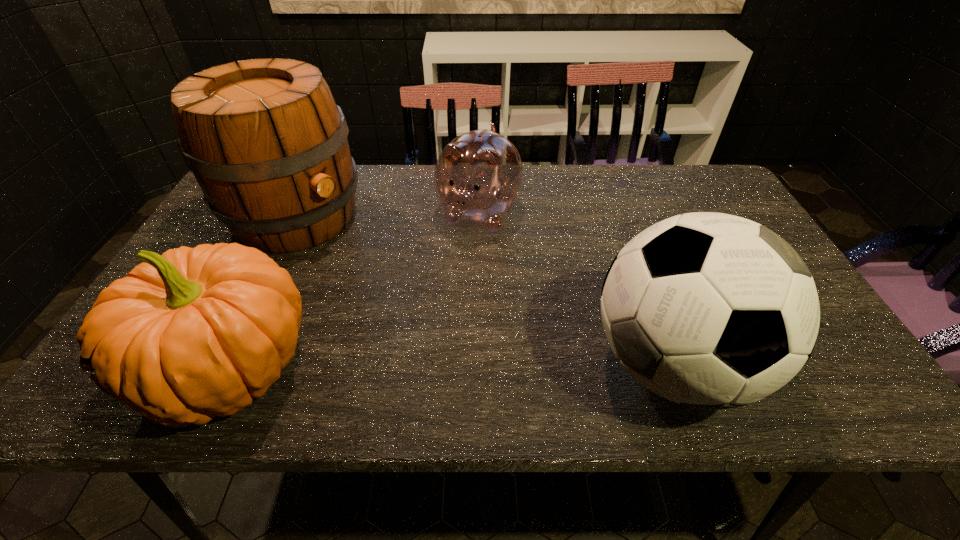
The width and height of the screenshot is (960, 540). I want to click on pumpkin, so coord(194,333).

This screenshot has width=960, height=540. I want to click on the rightmost object, so click(714, 311).

Where is `cider`? cider is located at coordinates pyautogui.click(x=265, y=140).

Locate an element on the screen. piggy bank is located at coordinates (478, 176).

At what (x,y) coordinates should I click in order to perform the action: click on the shortest object. Please return your answer as a coordinate pair (x, y). Looking at the image, I should click on (478, 176).

The image size is (960, 540). What are the coordinates of `free spot located 0.100m on the main logo of the soccer ball` in the screenshot? It's located at (804, 364).

I want to click on free space located 0.080m on the side of the cider where the spigot is located, so click(358, 258).

Image resolution: width=960 pixels, height=540 pixels. I want to click on blank space located 0.070m on the side of the cider where the spigot is located, so click(x=355, y=256).

This screenshot has width=960, height=540. I want to click on vacant space positioned 0.210m on the side of the cider where the spigot is located, so click(392, 281).

Locate an element on the screen. Image resolution: width=960 pixels, height=540 pixels. vacant space located 0.350m on the front facing side of the shortest object is located at coordinates (410, 342).